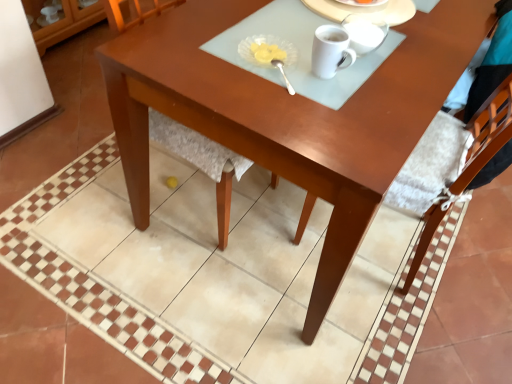
Question: Which direction should I rotate to look at white glossy mug at upper center, which appears as the first tableware when viewed from the top, — up or down?

Choices:
 (A) down
 (B) up

Answer: (B)

Question: Should I look upward or downward to see translucent glass dish at upper center, positioned as the third tableware in top-to-bottom order?

Choices:
 (A) down
 (B) up

Answer: (B)

Question: From the image's perspective, is glossy wood desk at center over translucent glass dish at upper center, the 2th tableware ordered from the bottom?

Choices:
 (A) yes
 (B) no

Answer: (A)

Question: From the image's perspective, is glossy wood desk at center below translucent glass dish at upper center, the 2th tableware ordered from the bottom?

Choices:
 (A) yes
 (B) no

Answer: (B)

Question: From a real-world perspective, is glossy wood desk at center positioned under translucent glass dish at upper center, the 2th tableware ordered from the bottom, based on gravity?

Choices:
 (A) yes
 (B) no

Answer: (A)

Question: Is translucent glass dish at upper center, positioned as the third tableware in top-to-bottom order, located within glossy wood desk at center?

Choices:
 (A) yes
 (B) no

Answer: (A)

Question: Does glossy wood desk at center have a smaller size compared to translucent glass dish at upper center, positioned as the third tableware in top-to-bottom order?

Choices:
 (A) yes
 (B) no

Answer: (B)

Question: Is glossy wood desk at center at the right side of translucent glass dish at upper center, positioned as the third tableware in top-to-bottom order?

Choices:
 (A) no
 (B) yes

Answer: (B)

Question: Is wooden chair at center turned away from translucent glass dish at upper center, the 2th tableware ordered from the bottom?

Choices:
 (A) no
 (B) yes

Answer: (A)

Question: Is wooden chair at center positioned before translucent glass dish at upper center, the 2th tableware ordered from the bottom?

Choices:
 (A) yes
 (B) no

Answer: (A)

Question: Considering the relative sizes of wooden chair at center and translucent glass dish at upper center, the 2th tableware ordered from the bottom, in the image provided, is wooden chair at center shorter than translucent glass dish at upper center, the 2th tableware ordered from the bottom,?

Choices:
 (A) no
 (B) yes

Answer: (A)

Question: Is wooden chair at center behind translucent glass dish at upper center, the 2th tableware ordered from the bottom?

Choices:
 (A) yes
 (B) no

Answer: (B)

Question: Considering the relative sizes of wooden chair at center and translucent glass dish at upper center, the 2th tableware ordered from the bottom, in the image provided, is wooden chair at center taller than translucent glass dish at upper center, the 2th tableware ordered from the bottom,?

Choices:
 (A) no
 (B) yes

Answer: (B)

Question: Can you see wooden chair at center touching translucent glass dish at upper center, the 2th tableware ordered from the bottom?

Choices:
 (A) yes
 (B) no

Answer: (B)

Question: Does white glossy mug at upper center touch glossy wood desk at center?

Choices:
 (A) no
 (B) yes

Answer: (A)